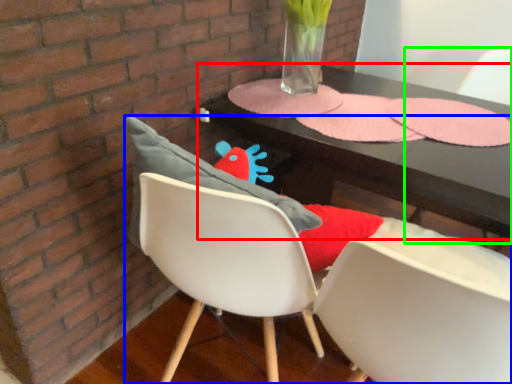
Question: Based on their relative distances, which object is farther from table (highlighted by a red box)? Choose from chair (highlighted by a blue box) and armchair (highlighted by a green box).

Choices:
 (A) chair
 (B) armchair

Answer: (B)